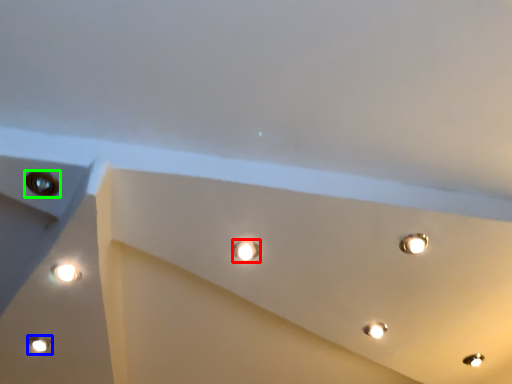
Question: Which is farther away from droplight (highlighted by a red box)? lamp (highlighted by a blue box) or hole (highlighted by a green box)?

Choices:
 (A) lamp
 (B) hole

Answer: (A)